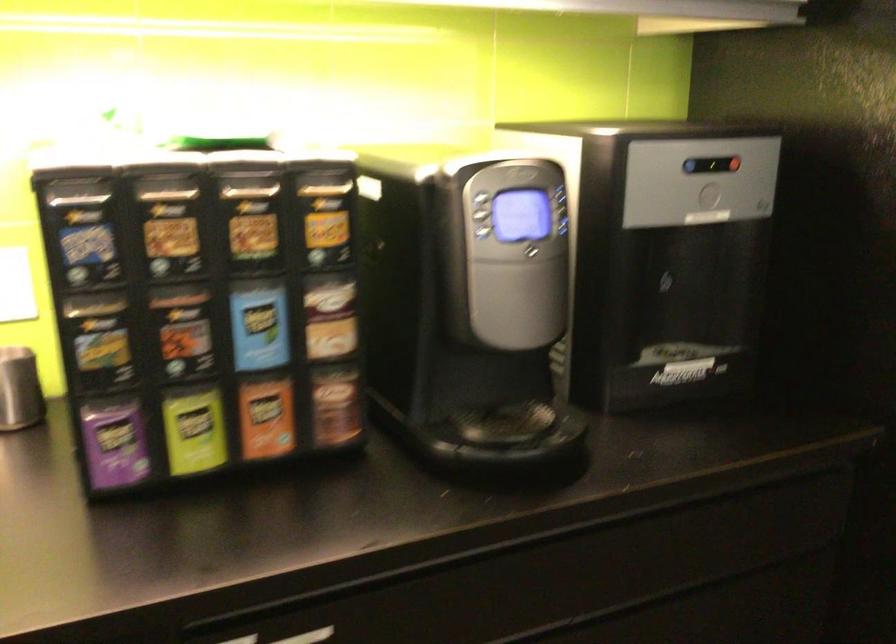
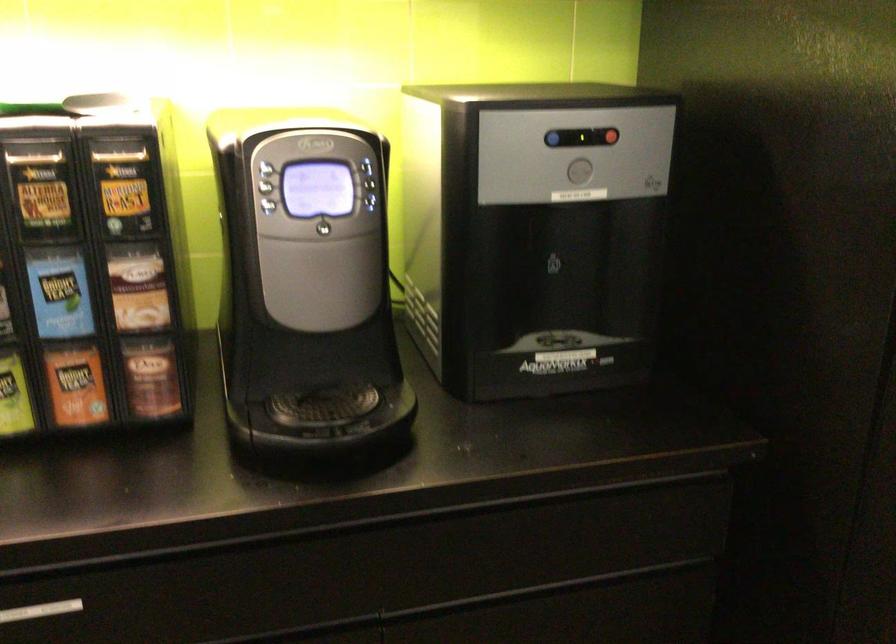
The point at [532,245] is marked in the first image. Where is the corresponding point in the second image?

(323, 222)